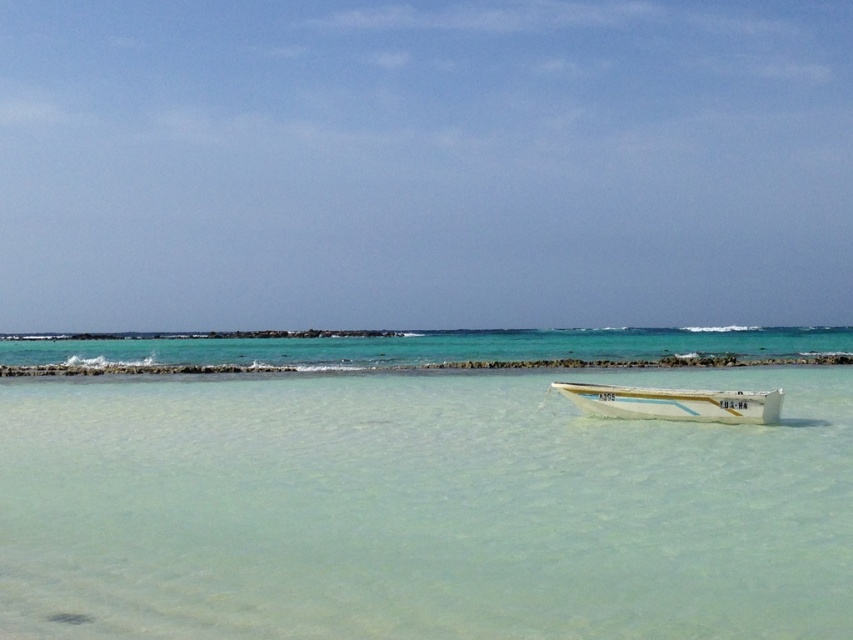
You are a sailor standing on the deck of the white glossy boat at center. You notice the clear water at boat right. Which object is taller from your perspective?

The clear water at boat right is taller than the white glossy boat at center from your perspective.

You are a marine biologist studying water clarity in this coastal area. You notice the clear water at boat right and the white glossy boat at center. Which of these two has a larger area or size?

The clear water at boat right has a larger size compared to the white glossy boat at center.